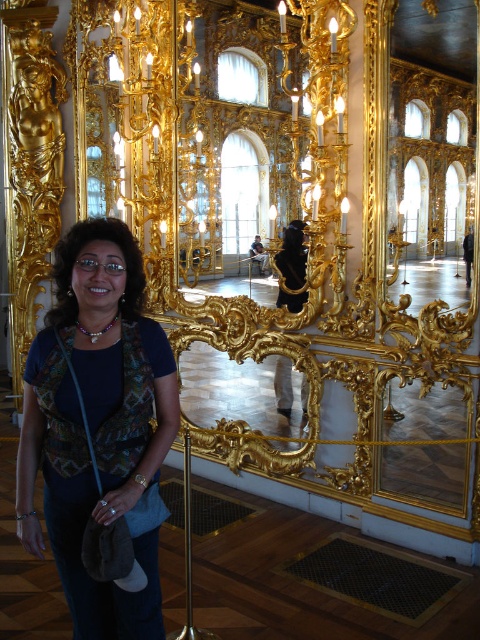
Question: Does matte blue shirt at center appear over gold ornate mirror at center?

Choices:
 (A) yes
 (B) no

Answer: (A)

Question: Where is matte blue shirt at center located in relation to gold ornate mirror at center in the image?

Choices:
 (A) above
 (B) below

Answer: (A)

Question: Is matte blue shirt at center wider than gold ornate mirror at center?

Choices:
 (A) yes
 (B) no

Answer: (B)

Question: Which point is closer to the camera taking this photo?

Choices:
 (A) pos(112,620)
 (B) pos(180,355)

Answer: (A)